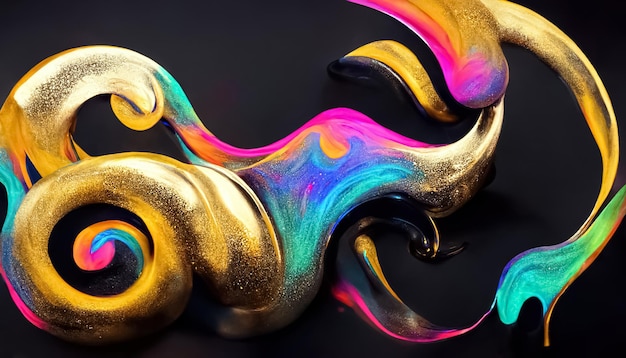
Find the location of `paint`. paint is located at coordinates (24, 277), (334, 185), (473, 52), (54, 103).